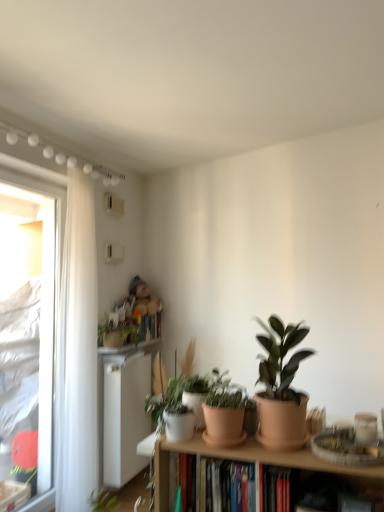
Measure the distance between point (118, 326) and camera.

A distance of 3.33 meters exists between point (118, 326) and camera.

The height and width of the screenshot is (512, 384). Describe the element at coordinates (223, 487) in the screenshot. I see `hardcover books at center` at that location.

What do you see at coordinates (281, 387) in the screenshot? The height and width of the screenshot is (512, 384). I see `matte terracotta pot at right, which is counted as the third houseplant, starting from the left` at bounding box center [281, 387].

Locate an element on the screen. This screenshot has width=384, height=512. terracotta clay pot at center is located at coordinates (223, 426).

Describe the element at coordinates (43, 306) in the screenshot. I see `transparent plastic window at left` at that location.

You are a GUI agent. You are given a task and a screenshot of the screen. Output one action in this format:
    pyautogui.click(x=<x>, y=<y>)
    Task: Click on the green matte plant at upper left, placed as the third houseplant when sorted from front to back
    
    Given the screenshot: What is the action you would take?
    pyautogui.click(x=116, y=333)

From a real-world perspective, which object rests below the other?

In real-world perspective, white glossy window sill at upper left is lower.

Is white glossy window sill at upper left positioned beyond the bounds of terracotta clay pot at center?

Absolutely, white glossy window sill at upper left is external to terracotta clay pot at center.

Can you confirm if white glossy window sill at upper left is smaller than terracotta clay pot at center?

No, white glossy window sill at upper left is not smaller than terracotta clay pot at center.

Image resolution: width=384 pixels, height=512 pixels. I want to click on window sill located below the terracotta clay pot at center (from the image's perspective), so click(128, 347).

Is white sheer curtain at left not near white plastic radiator at lower left?

Actually, white sheer curtain at left and white plastic radiator at lower left are a little close together.

Considering the relative sizes of white sheer curtain at left and white plastic radiator at lower left in the image provided, is white sheer curtain at left thinner than white plastic radiator at lower left?

Indeed, white sheer curtain at left has a lesser width compared to white plastic radiator at lower left.

Is white sheer curtain at left facing away from white plastic radiator at lower left?

white sheer curtain at left is not turned away from white plastic radiator at lower left.

Which object is further away from the camera, white sheer curtain at left or white plastic radiator at lower left?

Positioned behind is white plastic radiator at lower left.

Is green matte plant at upper left, marked as the third houseplant in a right-to-left arrangement, situated inside green matte plant at center, the second houseplant viewed from the right, or outside?

green matte plant at upper left, marked as the third houseplant in a right-to-left arrangement, is spatially situated outside green matte plant at center, the second houseplant viewed from the right.

From a real-world perspective, does green matte plant at upper left, placed as the third houseplant when sorted from front to back, sit lower than green matte plant at center, acting as the 2th houseplant starting from the front?

Actually, green matte plant at upper left, placed as the third houseplant when sorted from front to back, is physically above green matte plant at center, acting as the 2th houseplant starting from the front, in the real world.

Is green matte plant at upper left, which is the 1th houseplant in back-to-front order, not close to green matte plant at center, marked as the second houseplant in a back-to-front arrangement?

Yes, green matte plant at upper left, which is the 1th houseplant in back-to-front order, and green matte plant at center, marked as the second houseplant in a back-to-front arrangement, are quite far apart.

Who is shorter, green matte plant at upper left, placed as the third houseplant when sorted from front to back, or green matte plant at center, acting as the 2th houseplant starting from the front?

Standing shorter between the two is green matte plant at center, acting as the 2th houseplant starting from the front.

Can you confirm if white plastic radiator at lower left is positioned to the left of white glossy window sill at upper left?

Incorrect, white plastic radiator at lower left is not on the left side of white glossy window sill at upper left.

Is white plastic radiator at lower left turned away from white glossy window sill at upper left?

No, white plastic radiator at lower left's orientation is not away from white glossy window sill at upper left.

From a real-world perspective, is white plastic radiator at lower left below white glossy window sill at upper left?

Yes.

Which is further, (76, 339) or (193, 404)?

Point (76, 339)

From the image's perspective, count 2nd houseplants upward from the white sheer curtain at left and point to it. Please provide its 2D coordinates.

[(202, 392)]

Is white sheer curtain at left not close to green matte plant at center, acting as the 2th houseplant starting from the front?

Yes.

How different are the orientations of green matte plant at upper left, placed as the third houseplant when sorted from front to back, and white glossy window sill at upper left in degrees?

green matte plant at upper left, placed as the third houseplant when sorted from front to back, and white glossy window sill at upper left are facing 0.315 degrees away from each other.

Is green matte plant at upper left, which is the 1th houseplant in back-to-front order, oriented away from white glossy window sill at upper left?

No.

From a real-world perspective, is green matte plant at upper left, placed as the third houseplant when sorted from front to back, positioned above or below white glossy window sill at upper left?

From a real-world perspective, green matte plant at upper left, placed as the third houseplant when sorted from front to back, is physically above white glossy window sill at upper left.

Between green matte plant at upper left, placed as the third houseplant when sorted from front to back, and white glossy window sill at upper left, which one appears on the right side from the viewer's perspective?

Positioned to the right is white glossy window sill at upper left.

Is white plastic radiator at lower left to the right of terracotta clay pot at center from the viewer's perspective?

No, white plastic radiator at lower left is not to the right of terracotta clay pot at center.

Can you tell me how much white plastic radiator at lower left and terracotta clay pot at center differ in facing direction?

88.2 degrees separate the facing orientations of white plastic radiator at lower left and terracotta clay pot at center.

Which of these two, white plastic radiator at lower left or terracotta clay pot at center, is bigger?

white plastic radiator at lower left.

From a real-world perspective, is white plastic radiator at lower left physically above terracotta clay pot at center?

No.

At what (x,y) coordinates should I click in order to perform the action: click on window sill below the terracotta clay pot at center (from the image's perspective). Please return your answer as a coordinate pair (x, y). This screenshot has width=384, height=512. Looking at the image, I should click on (128, 347).

The image size is (384, 512). Find the location of `appliance behind the white sheer curtain at left`. appliance behind the white sheer curtain at left is located at coordinates (125, 415).

Based on their spatial positions, is transparent plastic window at left or terracotta clay pot at center closer to green matte plant at center, acting as the 2th houseplant starting from the front?

Based on the image, terracotta clay pot at center appears to be nearer to green matte plant at center, acting as the 2th houseplant starting from the front.

Considering their positions, is matte terracotta pot at right, the first houseplant from the front, positioned further to white plastic radiator at lower left than green matte plant at upper left, the first houseplant viewed from the left?

Among the two, matte terracotta pot at right, the first houseplant from the front, is located further to white plastic radiator at lower left.

Looking at the image, which one is located further to green matte plant at upper left, the first houseplant viewed from the left, transparent plastic window at left or hardcover books at center?

The object further to green matte plant at upper left, the first houseplant viewed from the left, is hardcover books at center.

When comparing their distances from white glossy window sill at upper left, does transparent plastic window at left or matte terracotta pot at right, the first houseplant from the front, seem further?

Based on the image, matte terracotta pot at right, the first houseplant from the front, appears to be further to white glossy window sill at upper left.

From the image, which object appears to be farther from terracotta clay pot at center, transparent plastic window at left or white sheer curtain at left?

transparent plastic window at left.

From the picture: Looking at the image, which one is located further to white sheer curtain at left, matte terracotta pot at right, which is counted as the third houseplant, starting from the left, or green matte plant at center, the 2th houseplant positioned from the left?

Based on the image, matte terracotta pot at right, which is counted as the third houseplant, starting from the left, appears to be further to white sheer curtain at left.

Considering their positions, is hardcover books at center positioned closer to green matte plant at upper left, placed as the third houseplant when sorted from front to back, than terracotta clay pot at center?

Based on the image, hardcover books at center appears to be nearer to green matte plant at upper left, placed as the third houseplant when sorted from front to back.

From the image, which object appears to be farther from hardcover books at center, white plastic radiator at lower left or terracotta clay pot at center?

The object further to hardcover books at center is white plastic radiator at lower left.

Identify the location of book between matte terracotta pot at right, acting as the 3th houseplant starting from the back, and white sheer curtain at left in the front-back direction. (223, 487).

Where is `houseplant between matte terracotta pot at right, which is counted as the third houseplant, starting from the left, and white sheer curtain at left, along the z-axis`? The height and width of the screenshot is (512, 384). houseplant between matte terracotta pot at right, which is counted as the third houseplant, starting from the left, and white sheer curtain at left, along the z-axis is located at coordinates (202, 392).

Image resolution: width=384 pixels, height=512 pixels. I want to click on houseplant positioned between hardcover books at center and green matte plant at upper left, which is the 1th houseplant in back-to-front order, from near to far, so click(x=202, y=392).

Find the location of `book between matte terracotta pot at right, placed as the 1th houseplant when sorted from right to left, and white plastic radiator at lower left from front to back`. book between matte terracotta pot at right, placed as the 1th houseplant when sorted from right to left, and white plastic radiator at lower left from front to back is located at coordinates (223, 487).